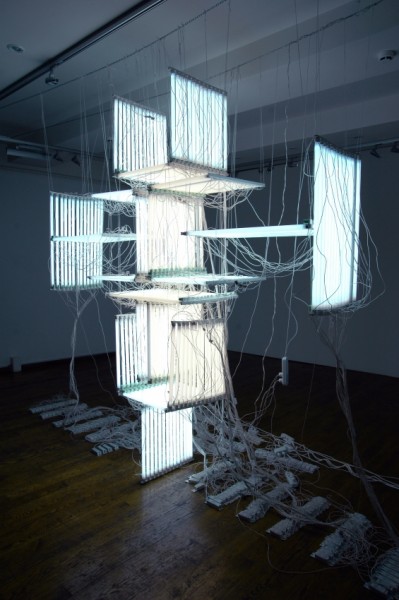
In order to click on ceiling in this screenshot , I will do point(99,57).